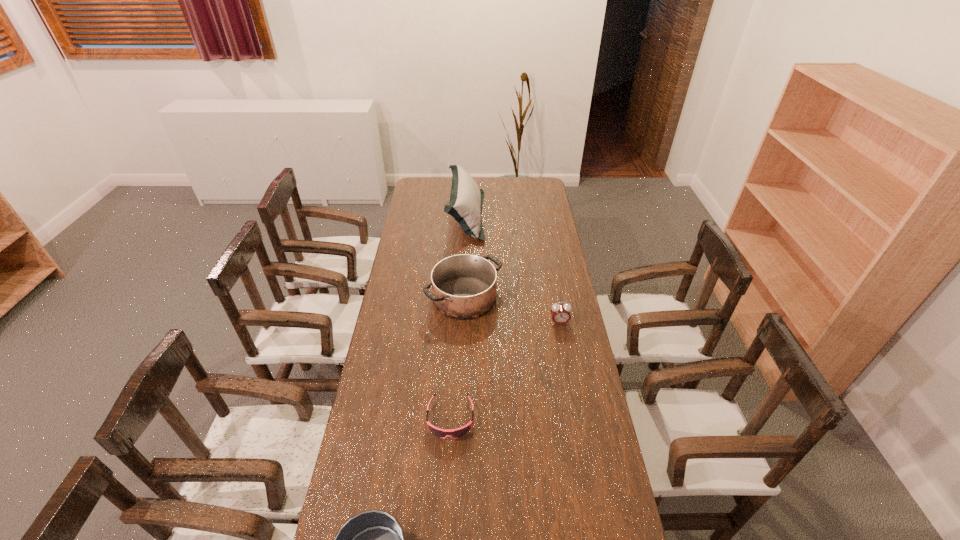
In order to click on free space that satisfies the following two spatial constraints: 1. on the surface of the farther saucepan; 2. on the right side of the tallest object in this screenshot , I will do `click(463, 298)`.

Identify the location of vacant space that satisfies the following two spatial constraints: 1. on the surface of the taller saucepan; 2. on the left side of the tallest object. Image resolution: width=960 pixels, height=540 pixels. (463, 298).

Identify the location of free location that satisfies the following two spatial constraints: 1. on the surface of the tallest object; 2. on the front-facing side of the goggles. This screenshot has width=960, height=540. (457, 418).